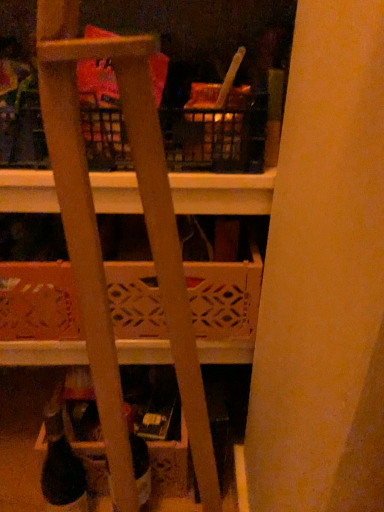
This screenshot has height=512, width=384. I want to click on matte plastic bottle at lower center, so click(x=138, y=458).

What do you see at coordinates (38, 302) in the screenshot? Image resolution: width=384 pixels, height=512 pixels. I see `wooden lattice basket at center` at bounding box center [38, 302].

Identify the location of matte plastic bottle at lower center. Image resolution: width=384 pixels, height=512 pixels. (138, 458).

Can you confirm if black matte wine bottle at lower left is smaller than matte plastic bottle at lower center?

Yes, black matte wine bottle at lower left is smaller than matte plastic bottle at lower center.

Is black matte wine bottle at lower left in contact with matte plastic bottle at lower center?

black matte wine bottle at lower left and matte plastic bottle at lower center are clearly separated.

Where is `bottle that is on the right side of black matte wine bottle at lower left`? bottle that is on the right side of black matte wine bottle at lower left is located at coordinates (138, 458).

What's the angular difference between black matte wine bottle at lower left and matte plastic bottle at lower center's facing directions?

There is a 4.22-degree angle between the facing directions of black matte wine bottle at lower left and matte plastic bottle at lower center.

Image resolution: width=384 pixels, height=512 pixels. Identify the location of bottle below the wooden lattice basket at center (from the image's perspective). (138, 458).

Considering the relative positions of matte plastic bottle at lower center and wooden lattice basket at center in the image provided, is matte plastic bottle at lower center to the right of wooden lattice basket at center from the viewer's perspective?

In fact, matte plastic bottle at lower center is to the left of wooden lattice basket at center.

Is wooden lattice basket at center surrounded by matte plastic bottle at lower center?

No, wooden lattice basket at center is not surrounded by matte plastic bottle at lower center.

Who is smaller, matte plastic bottle at lower center or wooden lattice basket at center?

With smaller size is matte plastic bottle at lower center.

Is wooden lattice basket at center aimed at matte plastic bottle at lower center?

No, wooden lattice basket at center is not aimed at matte plastic bottle at lower center.

Looking at this image, can you confirm if wooden lattice basket at center is taller than matte plastic bottle at lower center?

In fact, wooden lattice basket at center may be shorter than matte plastic bottle at lower center.

I want to click on bottle on the left of wooden lattice basket at center, so click(138, 458).

Can you tell me how much black matte wine bottle at lower left and wooden ladder at center differ in facing direction?

79.2 degrees.

Is black matte wine bottle at lower left wider than wooden ladder at center?

In fact, black matte wine bottle at lower left might be narrower than wooden ladder at center.

Does point (84, 478) come in front of point (48, 67)?

No, (84, 478) is behind (48, 67).

Between wooden ladder at center and wooden lattice basket at center, which one has more height?

Standing taller between the two is wooden ladder at center.

Between wooden ladder at center and wooden lattice basket at center, which one appears on the left side from the viewer's perspective?

From the viewer's perspective, wooden ladder at center appears more on the left side.

Is wooden ladder at center facing towards wooden lattice basket at center?

No.

Are wooden ladder at center and matte plastic bottle at lower center beside each other?

No, wooden ladder at center is not in contact with matte plastic bottle at lower center.

From a real-world perspective, which object rests below the other?

From a 3D spatial view, matte plastic bottle at lower center is below.

Considering the sizes of wooden ladder at center and matte plastic bottle at lower center in the image, is wooden ladder at center wider or thinner than matte plastic bottle at lower center?

Clearly, wooden ladder at center has more width compared to matte plastic bottle at lower center.

Does wooden ladder at center appear on the right side of matte plastic bottle at lower center?

Yes, wooden ladder at center is to the right of matte plastic bottle at lower center.

Is wooden ladder at center smaller than black matte wine bottle at lower left?

Incorrect, wooden ladder at center is not smaller in size than black matte wine bottle at lower left.

Does wooden ladder at center appear on the left side of black matte wine bottle at lower left?

In fact, wooden ladder at center is to the right of black matte wine bottle at lower left.

Which is correct: wooden ladder at center is inside black matte wine bottle at lower left, or outside of it?

wooden ladder at center is not enclosed by black matte wine bottle at lower left.

From the image's perspective, is wooden ladder at center above black matte wine bottle at lower left?

Indeed, from the image's perspective, wooden ladder at center is shown above black matte wine bottle at lower left.

Find the location of a particular element. This screenshot has height=512, width=384. wine bottle above the matte plastic bottle at lower center (from a real-world perspective) is located at coordinates (61, 468).

This screenshot has height=512, width=384. I want to click on bottle below the wooden lattice basket at center (from a real-world perspective), so [138, 458].

When comparing their distances from black matte wine bottle at lower left, does wooden lattice basket at center or wooden ladder at center seem further?

Among the two, wooden ladder at center is located further to black matte wine bottle at lower left.

Estimate the real-world distances between objects in this image. Which object is further from wooden ladder at center, matte plastic bottle at lower center or wooden lattice basket at center?

matte plastic bottle at lower center.

Looking at the image, which one is located further to black matte wine bottle at lower left, wooden ladder at center or matte plastic bottle at lower center?

The object further to black matte wine bottle at lower left is wooden ladder at center.

Which object lies nearer to the anchor point matte plastic bottle at lower center, wooden lattice basket at center or wooden ladder at center?

Among the two, wooden lattice basket at center is located nearer to matte plastic bottle at lower center.

Looking at the image, which one is located closer to black matte wine bottle at lower left, wooden lattice basket at center or matte plastic bottle at lower center?

matte plastic bottle at lower center lies closer to black matte wine bottle at lower left than the other object.

When comparing their distances from black matte wine bottle at lower left, does wooden ladder at center or wooden lattice basket at center seem closer?

wooden lattice basket at center is closer to black matte wine bottle at lower left.

Considering their positions, is black matte wine bottle at lower left positioned further to wooden ladder at center than wooden lattice basket at center?

Among the two, black matte wine bottle at lower left is located further to wooden ladder at center.

Considering their positions, is wooden lattice basket at center positioned closer to matte plastic bottle at lower center than black matte wine bottle at lower left?

Among the two, black matte wine bottle at lower left is located nearer to matte plastic bottle at lower center.

Where is `wine bottle located between wooden ladder at center and wooden lattice basket at center in the depth direction`? This screenshot has width=384, height=512. wine bottle located between wooden ladder at center and wooden lattice basket at center in the depth direction is located at coordinates (61, 468).

This screenshot has width=384, height=512. I want to click on bottle between wooden ladder at center and black matte wine bottle at lower left in the front-back direction, so click(138, 458).

Find the location of `bottle positioned between wooden ladder at center and wooden lattice basket at center from near to far`. bottle positioned between wooden ladder at center and wooden lattice basket at center from near to far is located at coordinates (138, 458).

I want to click on wine bottle between wooden lattice basket at center and matte plastic bottle at lower center in the vertical direction, so coord(61,468).